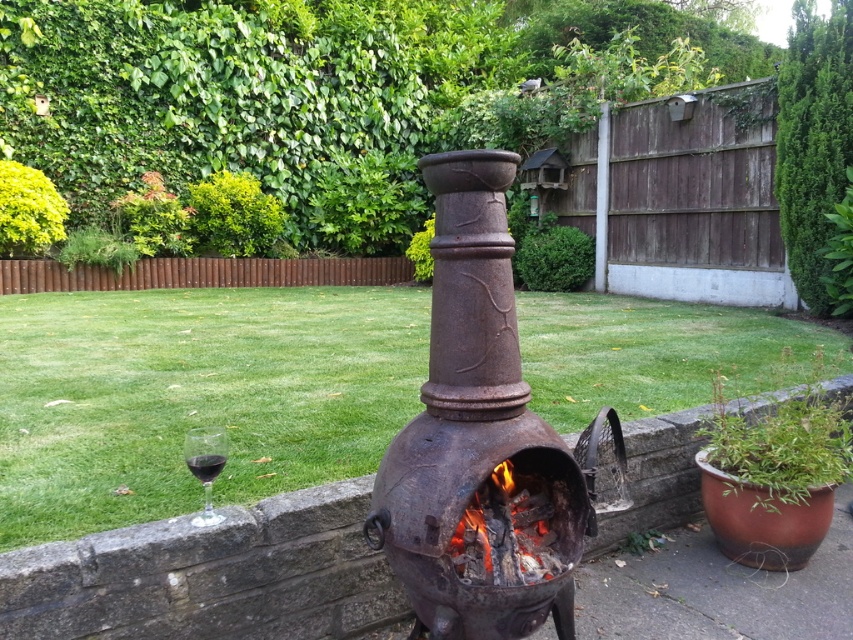
Question: Does rusty cast iron fire pit at center have a lesser width compared to charcoal black wood at center?

Choices:
 (A) no
 (B) yes

Answer: (A)

Question: Is rusty metal chiminea at center above charcoal black wood at center?

Choices:
 (A) no
 (B) yes

Answer: (B)

Question: Where is rusty metal chiminea at center located in relation to rusty cast iron fire pit at center in the image?

Choices:
 (A) right
 (B) left

Answer: (B)

Question: Which of the following is the farthest from the observer?

Choices:
 (A) (509, 486)
 (B) (550, 560)
 (C) (547, 380)

Answer: (C)

Question: Estimate the real-world distances between objects in this image. Which object is closer to the charcoal black wood at center?

Choices:
 (A) rusty metal chiminea at center
 (B) rusty cast iron fire pit at center

Answer: (B)

Question: Estimate the real-world distances between objects in this image. Which object is farther from the charcoal black wood at center?

Choices:
 (A) rusty metal chiminea at center
 (B) rusty cast iron fire pit at center

Answer: (A)